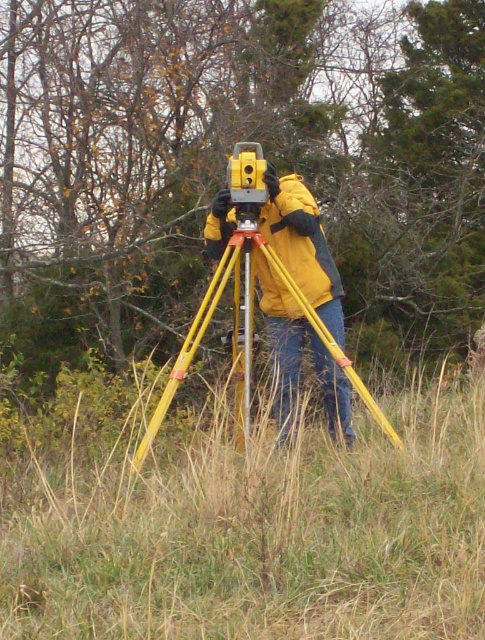
Question: Which of the following is the closest to the observer?

Choices:
 (A) (326, 250)
 (B) (247, 310)
 (C) (376, 632)

Answer: (C)

Question: Can you confirm if yellow plastic tripod at center is wider than metallic silver pole at center?

Choices:
 (A) no
 (B) yes

Answer: (B)

Question: Does green leafy tree at center appear over yellow plastic surveying instrument at center?

Choices:
 (A) no
 (B) yes

Answer: (B)

Question: Estimate the real-world distances between objects in this image. Which object is closer to the green leafy tree at center?

Choices:
 (A) yellow plastic tripod at center
 (B) yellow plastic surveying instrument at center
 (C) matte yellow jacket at center

Answer: (C)

Question: Among these objects, which one is nearest to the camera?

Choices:
 (A) dry grass at center
 (B) yellow plastic surveying instrument at center
 (C) yellow plastic tripod at center
 (D) metallic silver pole at center

Answer: (A)

Question: Can you confirm if dry grass at center is positioned to the left of yellow matte tripod at center?

Choices:
 (A) no
 (B) yes

Answer: (B)